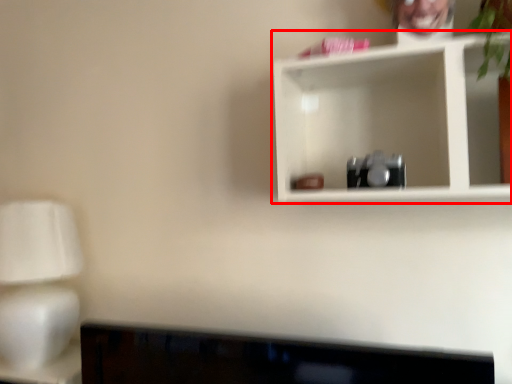
Question: Where is shelf (annotated by the red box) located in relation to table lamp in the image?

Choices:
 (A) left
 (B) right

Answer: (B)